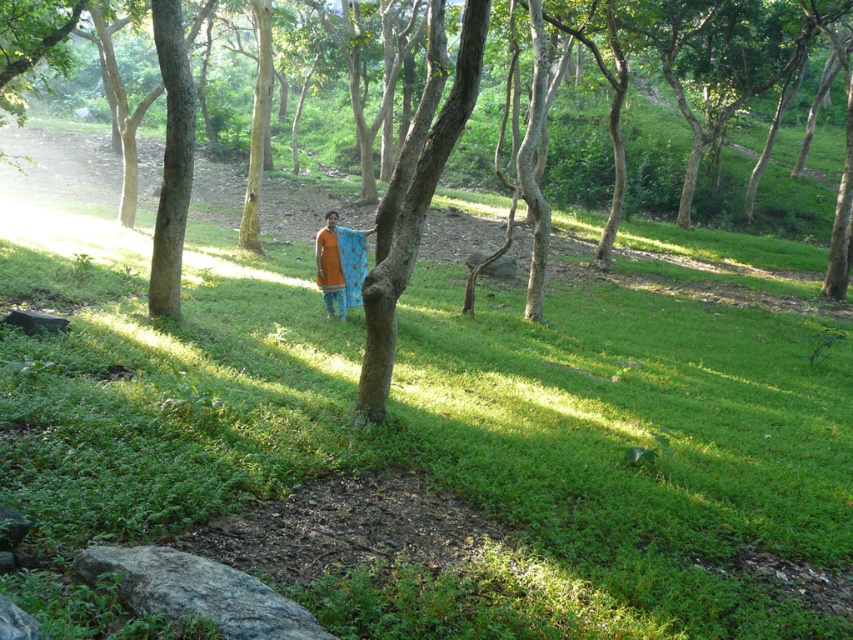
You are standing at the point marked by the coordinates point (439,435) in the image. What is the name of the object you are currently standing on?

The point (439,435) corresponds to the green grassy at center, so you are standing on the green grassy at center.